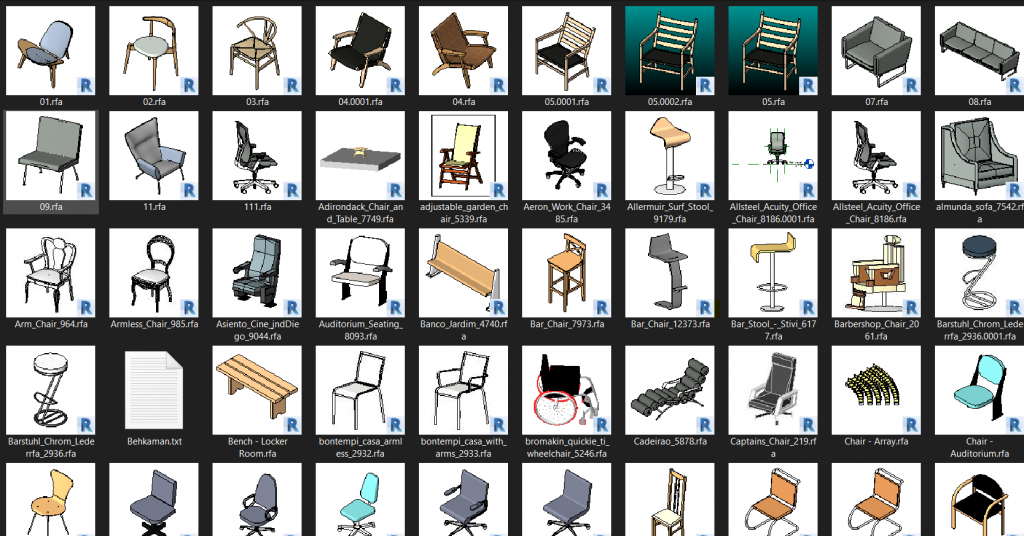
Locate an element on the screen. desk chairs is located at coordinates (262, 163), (892, 168), (762, 402), (446, 515), (562, 506), (350, 512), (272, 510), (188, 508), (565, 140), (775, 145).